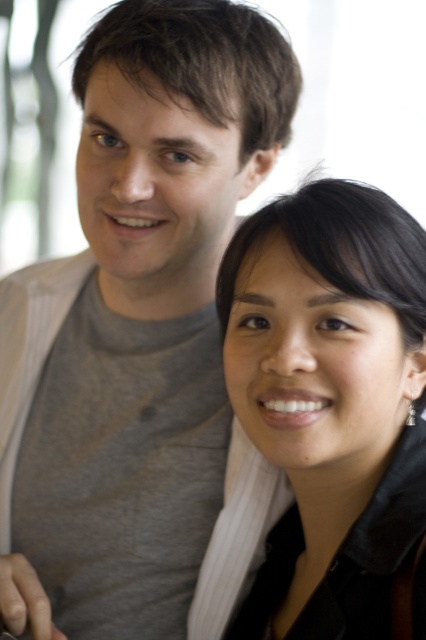
Can you confirm if gray cotton t-shirt at upper left is taller than black leather jacket at center?

Yes.

Is gray cotton t-shirt at upper left further to the viewer compared to black leather jacket at center?

Yes, gray cotton t-shirt at upper left is further from the viewer.

Is point (222, 508) more distant than point (333, 388)?

Yes, it is behind point (333, 388).

This screenshot has height=640, width=426. In order to click on gray cotton t-shirt at upper left in this screenshot , I will do `click(141, 337)`.